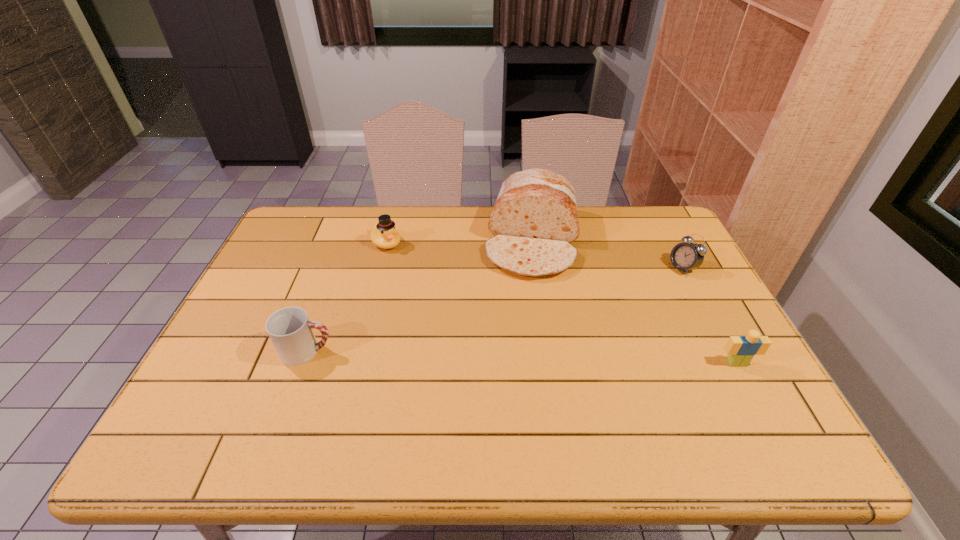
Find the location of a particular element. Image resolution: width=960 pixels, height=540 pixels. unoccupied area between the alarm clock and the Lego is located at coordinates (709, 315).

This screenshot has width=960, height=540. Identify the location of vacant space that's between the leftmost object and the third object from right to left. (420, 296).

Where is `unoccupied position between the bread and the cup`? unoccupied position between the bread and the cup is located at coordinates point(420,296).

You are a GUI agent. You are given a task and a screenshot of the screen. Output one action in this format:
    pyautogui.click(x=<x>, y=<y>)
    Task: Click on the empty space between the alarm clock and the Lego
    Image resolution: width=960 pixels, height=540 pixels.
    Given the screenshot: What is the action you would take?
    pyautogui.click(x=709, y=315)

Where is `free space between the Lego and the alarm clock`? This screenshot has width=960, height=540. free space between the Lego and the alarm clock is located at coordinates (709, 315).

At what (x,y) coordinates should I click in order to perform the action: click on free spot between the cup and the second object from left to right. Please return your answer as a coordinate pair (x, y). The image size is (960, 540). Looking at the image, I should click on (347, 297).

Identify which object is located as the nearest to the cup. Please provide its 2D coordinates. Your answer should be formatted as a tuple, i.e. [(x, y)], where the tuple contains the x and y coordinates of a point satisfying the conditions above.

[(384, 235)]

Locate which object ranks in proximity to the Lego. Please provide its 2D coordinates. Your answer should be formatted as a tuple, i.e. [(x, y)], where the tuple contains the x and y coordinates of a point satisfying the conditions above.

[(686, 256)]